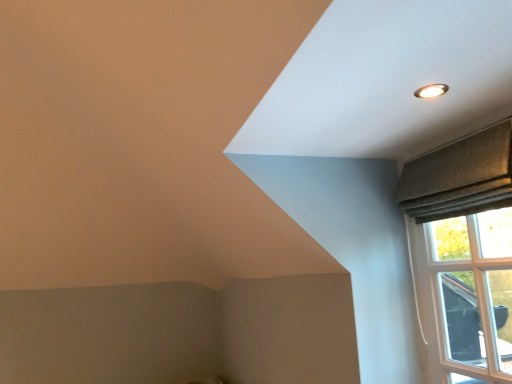
This screenshot has width=512, height=384. Describe the element at coordinates (466, 252) in the screenshot. I see `clear glass window at upper right` at that location.

Locate an element on the screen. clear glass window at upper right is located at coordinates click(466, 252).

This screenshot has height=384, width=512. I want to click on clear glass window at upper right, so click(x=466, y=252).